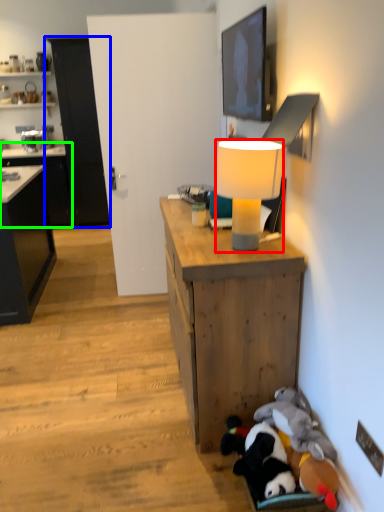
Question: Which is farther away from lamp (highlighted by a red box)? cabinetry (highlighted by a blue box) or cabinetry (highlighted by a green box)?

Choices:
 (A) cabinetry
 (B) cabinetry

Answer: (A)